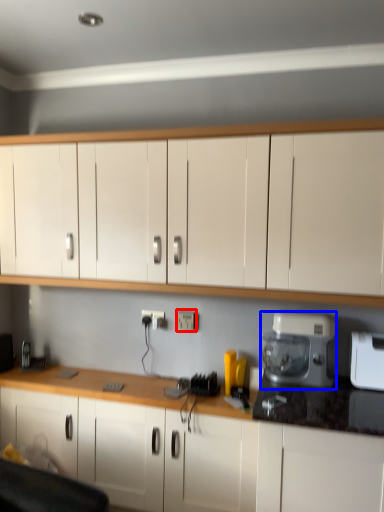
Question: Which point is closer to the camera, electric outlet (highlighted by a red box) or home appliance (highlighted by a blue box)?

Choices:
 (A) electric outlet
 (B) home appliance

Answer: (B)